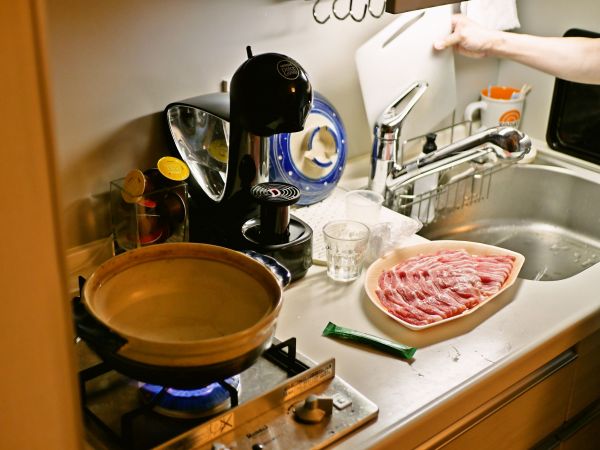
Where is `handle of sink`? This screenshot has width=600, height=450. handle of sink is located at coordinates (412, 100).